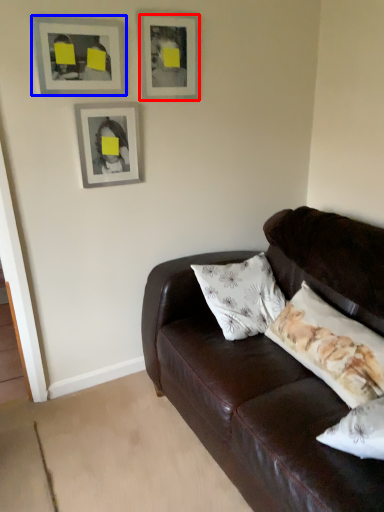
Question: Which object appears farthest to the camera in this image, picture frame (highlighted by a red box) or picture frame (highlighted by a blue box)?

Choices:
 (A) picture frame
 (B) picture frame

Answer: (A)